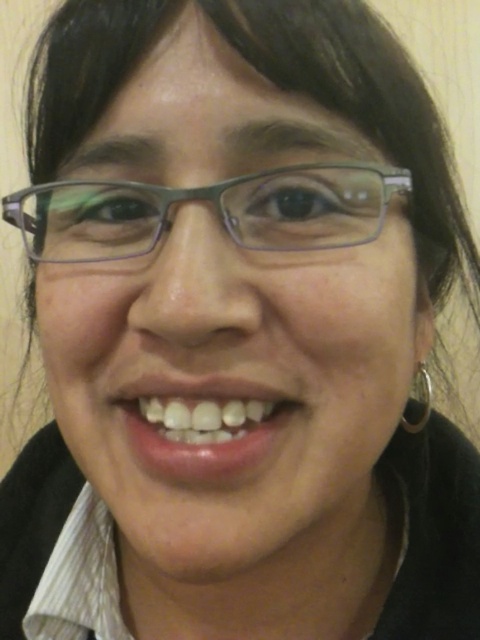
Question: Among these objects, which one is farthest from the camera?

Choices:
 (A) silver metallic hoop at right
 (B) glossy pink lips at center

Answer: (A)

Question: Among these points, which one is farthest from the camera?

Choices:
 (A) (224, 394)
 (B) (87, 211)

Answer: (B)

Question: Can you confirm if matte gray glasses at center is positioned below glossy pink lips at center?

Choices:
 (A) no
 (B) yes

Answer: (A)

Question: Does matte gray glasses at center lie behind silver metallic hoop at right?

Choices:
 (A) yes
 (B) no

Answer: (B)

Question: Can you confirm if glossy pink lips at center is positioned above silver metallic hoop at right?

Choices:
 (A) no
 (B) yes

Answer: (B)

Question: Estimate the real-world distances between objects in this image. Which object is closer to the silver metallic hoop at right?

Choices:
 (A) matte gray glasses at center
 (B) glossy pink lips at center

Answer: (B)